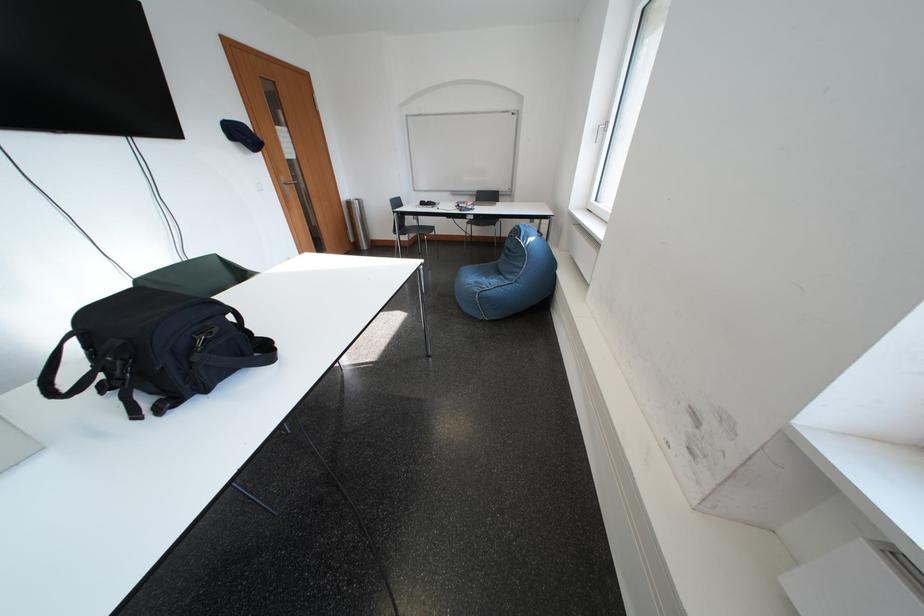
I want to click on bag strap, so click(x=62, y=374).